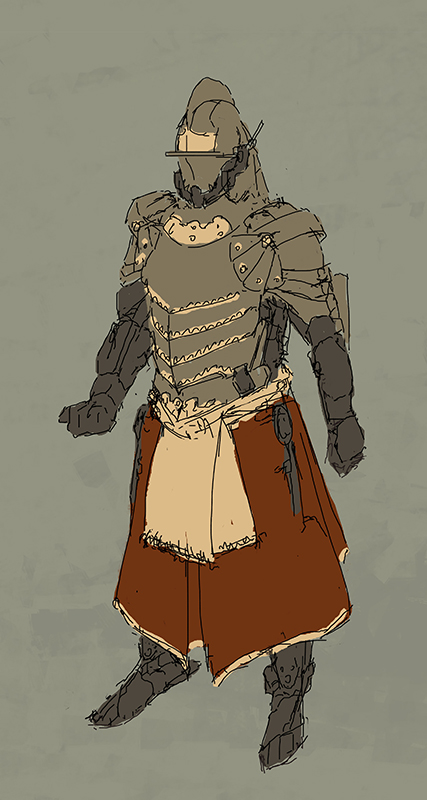
Identify the location of sash. (185, 504).